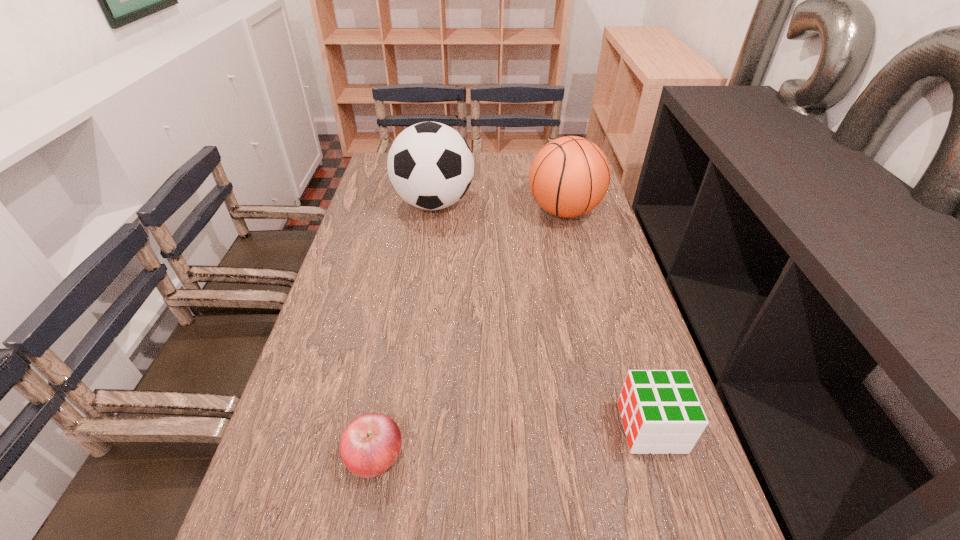
Find the location of `vacant area that lies between the cube and the soccer ball`. vacant area that lies between the cube and the soccer ball is located at coordinates (542, 315).

Image resolution: width=960 pixels, height=540 pixels. I want to click on vacant point located between the cube and the basketball, so click(608, 319).

This screenshot has width=960, height=540. I want to click on unoccupied area between the basketball and the soccer ball, so click(x=499, y=207).

At what (x,y) coordinates should I click in order to perform the action: click on free space between the basketball and the cube. Please return your answer as a coordinate pair (x, y). This screenshot has width=960, height=540. Looking at the image, I should click on (608, 319).

Find the location of a particular element. The height and width of the screenshot is (540, 960). vacant area that lies between the soccer ball and the apple is located at coordinates (404, 329).

Find the location of a particular element. This screenshot has height=540, width=960. empty space that is in between the soccer ball and the basketball is located at coordinates (499, 207).

This screenshot has height=540, width=960. In order to click on free space between the soccer ball and the basketball in this screenshot , I will do `click(499, 207)`.

Identify the location of object that stands as the second closest to the soccer ball. The height and width of the screenshot is (540, 960). (370, 444).

Find the location of `object that stands as the closest to the basketball`. object that stands as the closest to the basketball is located at coordinates (430, 165).

Find the location of a particular element. The height and width of the screenshot is (540, 960). blank space that satisfies the following two spatial constraints: 1. on the front side of the soccer ball; 2. on the left side of the basketball is located at coordinates (433, 211).